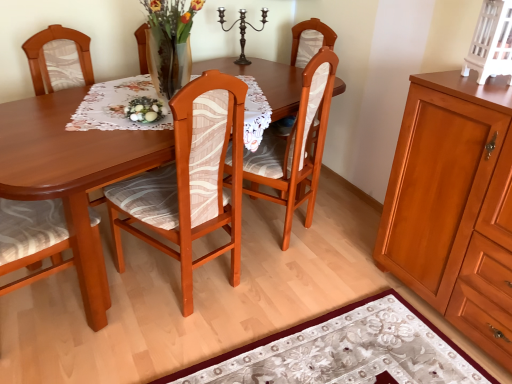
Question: Is matte wood cabinet at right, the first cabinetry in the bottom-to-top sequence, to the left or to the right of wooden chair at center, positioned as the third chair in right-to-left order, in the image?

Choices:
 (A) right
 (B) left

Answer: (A)

Question: In terms of width, does matte wood cabinet at right, the first cabinetry in the bottom-to-top sequence, look wider or thinner when compared to wooden chair at center, positioned as the third chair in right-to-left order?

Choices:
 (A) wide
 (B) thin

Answer: (A)

Question: Which of these objects is positioned farthest from the wooden chair at center, marked as the first chair in a right-to-left arrangement?

Choices:
 (A) floral-patterned fabric at lower center
 (B) white painted wood cabinet at upper right, the second cabinetry ordered from the bottom
 (C) white lace tablecloth at center
 (D) white glossy eggs at center
 (E) wooden chair at center, positioned as the third chair in right-to-left order

Answer: (E)

Question: Which is farther from the white glossy eggs at center?

Choices:
 (A) white lace tablecloth at center
 (B) wooden chair at center, marked as the first chair in a right-to-left arrangement
 (C) matte wood cabinet at right, placed as the second cabinetry when sorted from top to bottom
 (D) white painted wood cabinet at upper right, the second cabinetry ordered from the bottom
 (E) dark brown metal candle holder at upper center

Answer: (D)